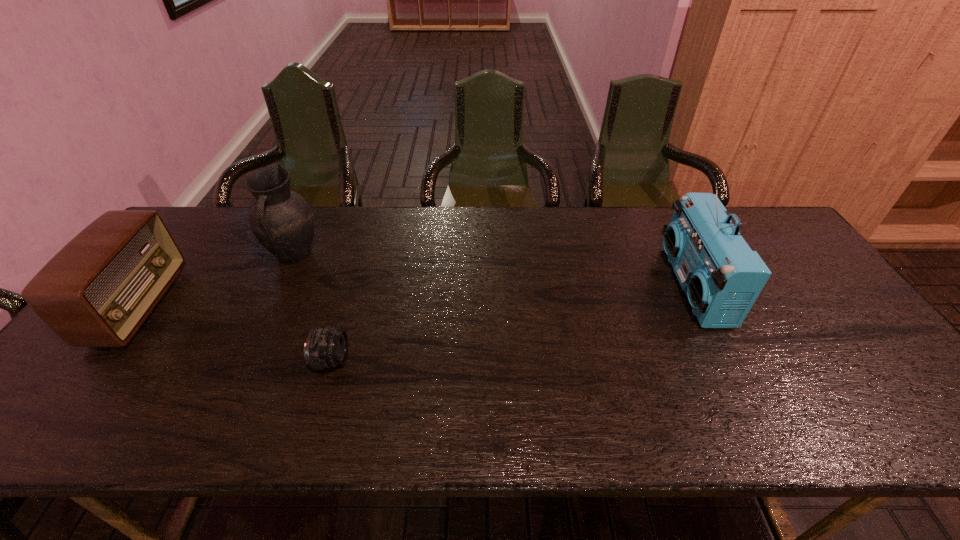
Find the location of a particular element. This screenshot has height=540, width=960. empty space that is in between the third object from right to left and the shorter radio receiver is located at coordinates (217, 281).

Identify the location of vacant point located between the left radio receiver and the telephoto lens. (235, 333).

Find the location of a particular element. This screenshot has width=960, height=540. empty space between the third object from left to right and the second object from left to right is located at coordinates (313, 308).

In order to click on free space between the rightmost object and the left radio receiver in this screenshot , I will do `click(417, 296)`.

Identify the location of vacant space that is in between the second object from left to right and the second object from right to left. (313, 308).

Identify the location of blank region between the pitcher and the taller radio receiver. (493, 271).

The image size is (960, 540). Identify the location of free spot between the second object from right to left and the pitcher. (313, 308).

Locate an element on the screen. The image size is (960, 540). empty space between the second object from right to left and the taller radio receiver is located at coordinates (513, 323).

I want to click on empty space between the leftmost object and the second object from left to right, so click(217, 281).

In order to click on free space between the rightmost object and the shorter radio receiver in this screenshot , I will do `click(417, 296)`.